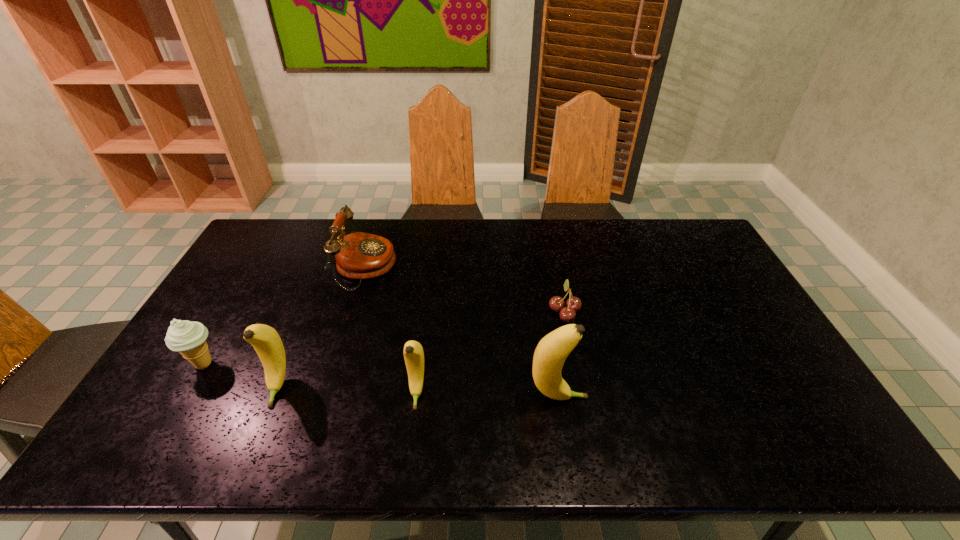
Locate an element on the screen. the second object from left to right is located at coordinates (267, 343).

The image size is (960, 540). Find the location of `the second tallest object`. the second tallest object is located at coordinates (267, 343).

You are a GUI agent. You are given a task and a screenshot of the screen. Output one action in this format:
    pyautogui.click(x=<x>, y=<y>)
    Task: Click on the shortest banana
    This screenshot has height=540, width=960.
    Given the screenshot: What is the action you would take?
    pyautogui.click(x=413, y=352)

Locate an element on the screen. Image resolution: width=960 pixels, height=540 pixels. the second banana from left to right is located at coordinates (413, 352).

Identify the location of the rightmost banana. (550, 354).

Where is `the farthest object`? the farthest object is located at coordinates (359, 255).

Where is `telephone`? This screenshot has height=540, width=960. telephone is located at coordinates (359, 255).

Where is `the leftmost object`? the leftmost object is located at coordinates (188, 338).

Locate an element on the screen. This screenshot has width=960, height=540. the shortest object is located at coordinates point(573,304).

Identify the location of cherry. (573, 304).